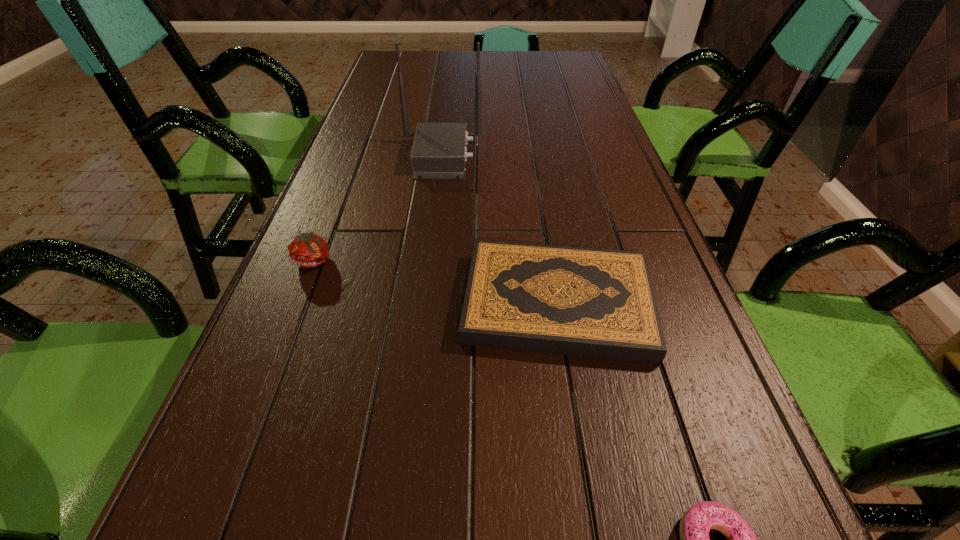
At what (x,y) coordinates should I click in order to perform the action: click on object identified as the third closest to the leftmost object. Please return your answer as a coordinate pair (x, y). Looking at the image, I should click on (696, 522).

The width and height of the screenshot is (960, 540). Find the location of `vacant region that satisfies the following two spatial constraints: 1. on the back of the router to connect cables; 2. on the left side of the hardback book`. vacant region that satisfies the following two spatial constraints: 1. on the back of the router to connect cables; 2. on the left side of the hardback book is located at coordinates (423, 304).

The image size is (960, 540). I want to click on free spot that satisfies the following two spatial constraints: 1. on the back side of the hardback book; 2. on the back of the router to connect cables, so click(533, 156).

The image size is (960, 540). I want to click on free point that satisfies the following two spatial constraints: 1. on the back of the tallest object to connect cables; 2. on the left side of the hardback book, so (x=423, y=304).

Where is `vacant area in the image that satisfies the following two spatial constraints: 1. on the back of the farthest object to connect cables; 2. on the back side of the hardback book`? This screenshot has height=540, width=960. vacant area in the image that satisfies the following two spatial constraints: 1. on the back of the farthest object to connect cables; 2. on the back side of the hardback book is located at coordinates (423, 304).

Identify the location of vacant space that satisfies the following two spatial constraints: 1. on the back of the hardback book to connect cables; 2. on the right side of the router. (423, 304).